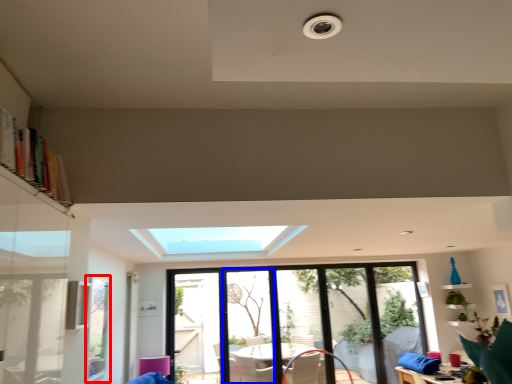
Question: Which point is further to the camera, window screen (highlighted by a red box) or screen door (highlighted by a blue box)?

Choices:
 (A) window screen
 (B) screen door

Answer: (B)